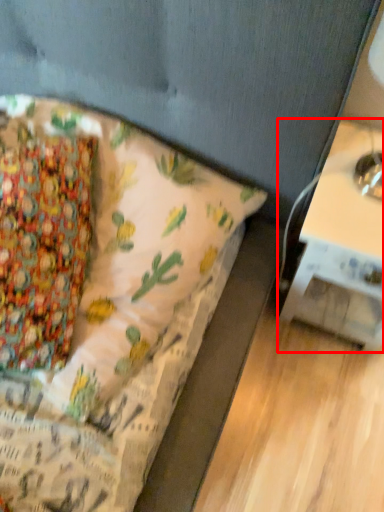
Question: From the image's perspective, where is table (annotated by the red box) located relative to bed?

Choices:
 (A) above
 (B) below

Answer: (B)